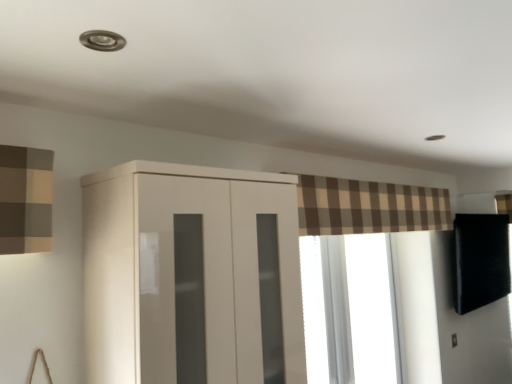
Question: Is brown plaid curtain at upper center facing towards transparent glass window at center?

Choices:
 (A) yes
 (B) no

Answer: (B)

Question: From the image's perspective, is brown plaid curtain at upper center located beneath transparent glass window at center?

Choices:
 (A) yes
 (B) no

Answer: (B)

Question: Would you say brown plaid curtain at upper center is a long distance from transparent glass window at center?

Choices:
 (A) no
 (B) yes

Answer: (A)

Question: From a real-world perspective, is brown plaid curtain at upper center below transparent glass window at center?

Choices:
 (A) no
 (B) yes

Answer: (A)

Question: Does brown plaid curtain at upper center have a greater width compared to transparent glass window at center?

Choices:
 (A) no
 (B) yes

Answer: (B)

Question: From a real-world perspective, is brown plaid curtain at upper center above or below glossy white cupboard at center?

Choices:
 (A) above
 (B) below

Answer: (A)

Question: Is brown plaid curtain at upper center to the left or to the right of glossy white cupboard at center in the image?

Choices:
 (A) left
 (B) right

Answer: (B)

Question: From the image's perspective, is brown plaid curtain at upper center positioned above or below glossy white cupboard at center?

Choices:
 (A) below
 (B) above

Answer: (B)

Question: Looking at their shapes, would you say brown plaid curtain at upper center is wider or thinner than glossy white cupboard at center?

Choices:
 (A) wide
 (B) thin

Answer: (B)

Question: Is transparent glass window at center inside the boundaries of brown plaid curtain at upper center, or outside?

Choices:
 (A) outside
 (B) inside

Answer: (A)

Question: Is point (350, 261) positioned closer to the camera than point (415, 208)?

Choices:
 (A) farther
 (B) closer

Answer: (A)

Question: Considering the positions of transparent glass window at center and brown plaid curtain at upper center in the image, is transparent glass window at center taller or shorter than brown plaid curtain at upper center?

Choices:
 (A) tall
 (B) short

Answer: (A)

Question: Looking at their shapes, would you say transparent glass window at center is wider or thinner than brown plaid curtain at upper center?

Choices:
 (A) wide
 (B) thin

Answer: (B)

Question: Based on their positions, is glossy white cupboard at center located to the left or right of transparent glass window at center?

Choices:
 (A) left
 (B) right

Answer: (A)

Question: Based on their sizes in the image, would you say glossy white cupboard at center is bigger or smaller than transparent glass window at center?

Choices:
 (A) small
 (B) big

Answer: (B)